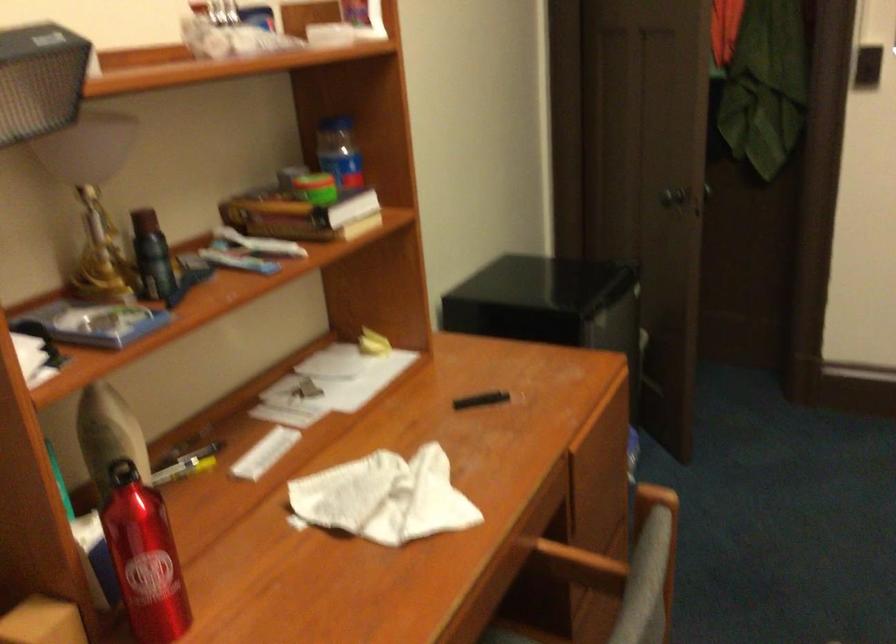
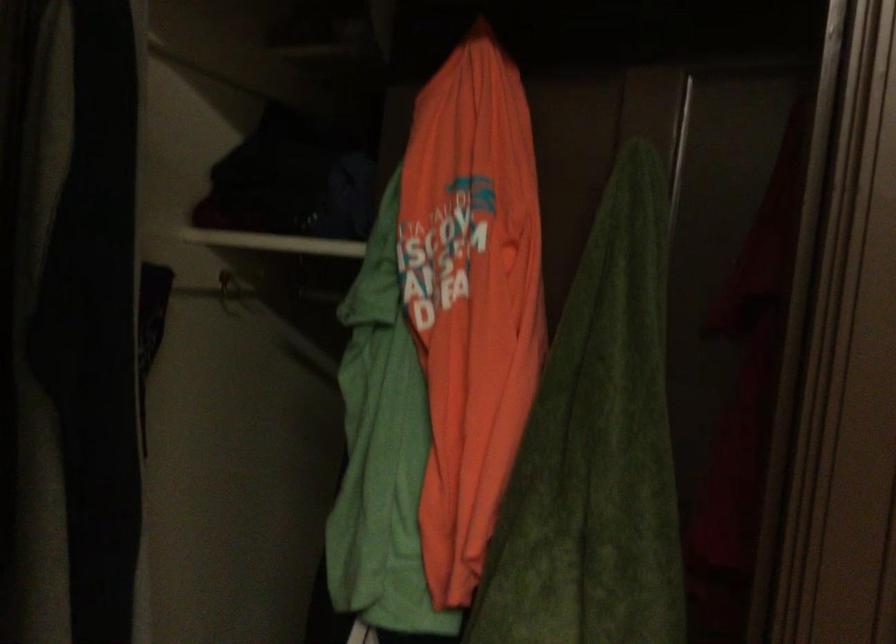
What movement of the cameraman would produce the second image?

The movement direction of the cameraman is right, forward.